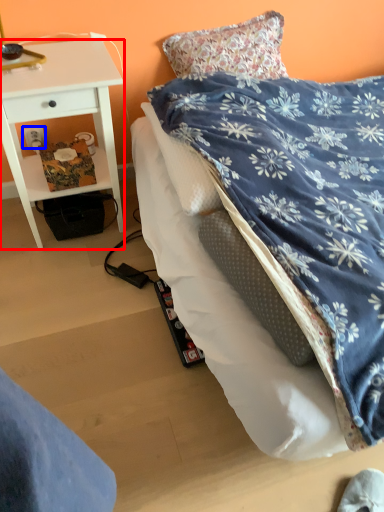
Question: Among these objects, which one is farthest to the camera, desk (highlighted by a red box) or power outlet (highlighted by a blue box)?

Choices:
 (A) desk
 (B) power outlet

Answer: (B)